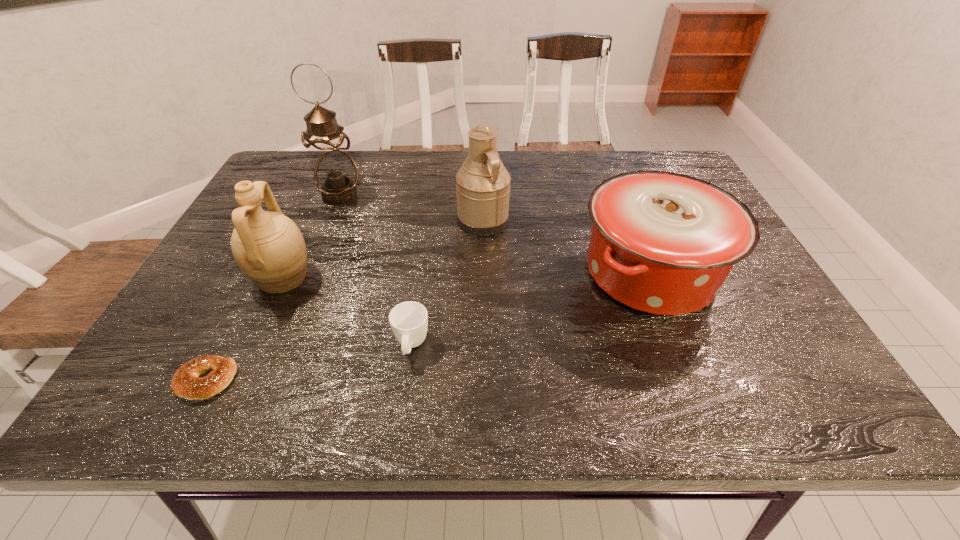
Identify the location of vacant space at the far edge. (597, 166).

Locate an element on the screen. free region at the near edge of the desktop is located at coordinates (401, 399).

You are a GUI agent. You are given a task and a screenshot of the screen. Output one action in this format:
    pyautogui.click(x=<x>, y=<y>)
    Task: Click on the blank space at the left edge
    The height and width of the screenshot is (540, 960).
    Given the screenshot: What is the action you would take?
    pyautogui.click(x=218, y=302)

Locate an element on the screen. The image size is (960, 540). free space at the right edge is located at coordinates (766, 360).

Identify the location of vacant space at the far right corner. click(x=640, y=169).

Find the location of a particular element. vacant point located between the left pitcher and the oil lamp is located at coordinates (311, 237).

This screenshot has width=960, height=540. What are the coordinates of `vacant region between the fourth object from left to right and the oil lamp` in the screenshot? It's located at (375, 270).

Find the location of `unoccupied position between the nearer pitcher and the bagel`. unoccupied position between the nearer pitcher and the bagel is located at coordinates (244, 329).

At what (x,y) coordinates should I click in order to perform the action: click on vacant area that lies between the third object from right to left and the shortest object. Please return your answer as a coordinate pair (x, y). The height and width of the screenshot is (540, 960). Looking at the image, I should click on (309, 363).

The image size is (960, 540). I want to click on free space between the shortest object and the nearer pitcher, so click(x=244, y=329).